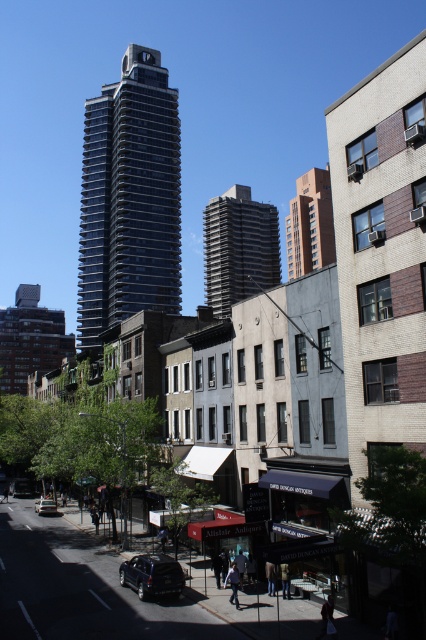
You are a photographer wanting to capture both the dark gray concrete building at center and the burgundy brick building at upper center in the same frame. Based on their positions, which building should you adjust your camera to focus on first to ensure both are in the shot?

Since the dark gray concrete building at center is to the left of the burgundy brick building at upper center, you should focus on the burgundy brick building at upper center first to ensure both are in the frame.

You are a delivery drone with a maximum flight altitude of 50 meters. You need to deliver a package to the dark gray concrete building at center. The building you are coming from is 1.9 meters tall. Can you fly directly between the two buildings without exceeding your altitude limit?

The distance between the dark gray concrete building at center and the starting building is 48.17 meters. Since the drone can fly up to 50 meters, it can safely fly between them without exceeding its altitude limit.

You are a city planner assessing the urban landscape. You need to determine if the shiny black suv at lower left can park under the dark gray concrete building at center without hitting its roof. Based on the scene, can it?

The dark gray concrete building at center is taller than the shiny black suv at lower left, so the suv can park under it without hitting the roof.